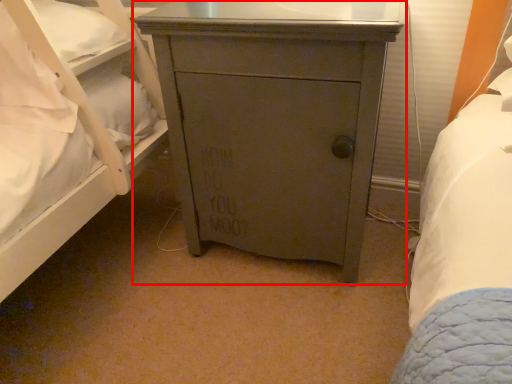
Question: From the image's perspective, where is chest of drawers (annotated by the red box) located relative to pillow?

Choices:
 (A) above
 (B) below

Answer: (B)